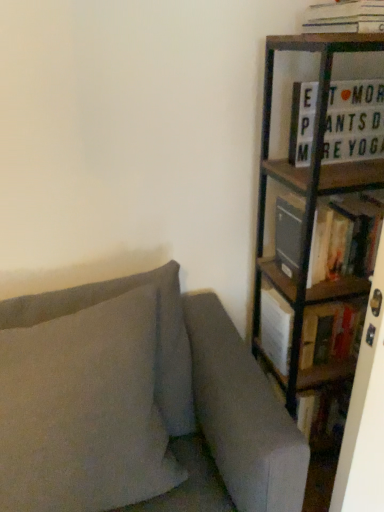
Measure the distance between point (297,111) and camera.

Point (297,111) and camera are 1.36 meters apart from each other.

What is the approximate height of hardcover book at right, the 3th book positioned from the top?

10.32 inches.

The height and width of the screenshot is (512, 384). Find the location of `hardcover book at right, which is the 1th book from bottom to top`. hardcover book at right, which is the 1th book from bottom to top is located at coordinates (329, 330).

Where is `white paper stack at upper right, which ranks as the third book in bottom-to-top order`? This screenshot has height=512, width=384. white paper stack at upper right, which ranks as the third book in bottom-to-top order is located at coordinates (345, 17).

The image size is (384, 512). Describe the element at coordinates (309, 209) in the screenshot. I see `wooden bookcase at right` at that location.

This screenshot has width=384, height=512. Find the location of `white plastic sign at upper right, which is counted as the second book, starting from the top`. white plastic sign at upper right, which is counted as the second book, starting from the top is located at coordinates (354, 121).

Based on the photo, is suede-like gray pillow at left to the left or to the right of white paper stack at upper right, which ranks as the third book in bottom-to-top order, in the image?

suede-like gray pillow at left is positioned on white paper stack at upper right, which ranks as the third book in bottom-to-top order,'s left side.

Considering the relative sizes of suede-like gray pillow at left and white paper stack at upper right, which ranks as the first book in top-to-bottom order, in the image provided, is suede-like gray pillow at left shorter than white paper stack at upper right, which ranks as the first book in top-to-bottom order,?

No, suede-like gray pillow at left is not shorter than white paper stack at upper right, which ranks as the first book in top-to-bottom order.

From a real-world perspective, who is located lower, suede-like gray pillow at left or white paper stack at upper right, which ranks as the first book in top-to-bottom order?

suede-like gray pillow at left.

Considering the sizes of objects white paper stack at upper right, which ranks as the first book in top-to-bottom order, and white plastic sign at upper right, which is counted as the second book, starting from the top, in the image provided, who is shorter, white paper stack at upper right, which ranks as the first book in top-to-bottom order, or white plastic sign at upper right, which is counted as the second book, starting from the top,?

Standing shorter between the two is white paper stack at upper right, which ranks as the first book in top-to-bottom order.

In the scene shown: Is white paper stack at upper right, which ranks as the first book in top-to-bottom order, situated inside white plastic sign at upper right, which is counted as the second book, starting from the top, or outside?

white paper stack at upper right, which ranks as the first book in top-to-bottom order, is spatially situated outside white plastic sign at upper right, which is counted as the second book, starting from the top.

From the image's perspective, is white paper stack at upper right, which ranks as the first book in top-to-bottom order, above white plastic sign at upper right, which ranks as the 2th book in bottom-to-top order?

Indeed, from the image's perspective, white paper stack at upper right, which ranks as the first book in top-to-bottom order, is shown above white plastic sign at upper right, which ranks as the 2th book in bottom-to-top order.

Which of these two, white paper stack at upper right, which ranks as the third book in bottom-to-top order, or white plastic sign at upper right, which is counted as the second book, starting from the top, is thinner?

Thinner between the two is white plastic sign at upper right, which is counted as the second book, starting from the top.

Is wooden bookshelf at right next to white plastic sign at upper right, which ranks as the 2th book in bottom-to-top order?

wooden bookshelf at right and white plastic sign at upper right, which ranks as the 2th book in bottom-to-top order, are clearly separated.

Is wooden bookshelf at right positioned with its back to white plastic sign at upper right, which is counted as the second book, starting from the top?

wooden bookshelf at right is not turned away from white plastic sign at upper right, which is counted as the second book, starting from the top.

Is point (312, 289) closer or farther from the camera than point (357, 135)?

Point (312, 289) is farther from the camera than point (357, 135).

Considering the relative positions of wooden bookshelf at right and white plastic sign at upper right, which is counted as the second book, starting from the top, in the image provided, is wooden bookshelf at right in front of white plastic sign at upper right, which is counted as the second book, starting from the top,?

No, wooden bookshelf at right is behind white plastic sign at upper right, which is counted as the second book, starting from the top.

Which of these two, wooden bookcase at right or white plastic sign at upper right, which ranks as the 2th book in bottom-to-top order, stands shorter?

white plastic sign at upper right, which ranks as the 2th book in bottom-to-top order, is shorter.

Between wooden bookcase at right and white plastic sign at upper right, which is counted as the second book, starting from the top, which one has smaller size?

With smaller size is white plastic sign at upper right, which is counted as the second book, starting from the top.

Which point is more forward, (x=277, y=163) or (x=332, y=115)?

The point (x=332, y=115) is in front.

From a real-world perspective, which is physically below, wooden bookcase at right or white plastic sign at upper right, which is counted as the second book, starting from the top?

In real-world perspective, wooden bookcase at right is lower.

Is point (61, 321) positioned behind point (291, 168)?

That is False.

Considering the relative positions of suede-like gray pillow at left and wooden bookcase at right in the image provided, is suede-like gray pillow at left to the left of wooden bookcase at right from the viewer's perspective?

Indeed, suede-like gray pillow at left is positioned on the left side of wooden bookcase at right.

From the image's perspective, is suede-like gray pillow at left under wooden bookcase at right?

Yes, from the image's perspective, suede-like gray pillow at left is beneath wooden bookcase at right.

In terms of width, does suede-like gray pillow at left look wider or thinner when compared to wooden bookcase at right?

suede-like gray pillow at left is thinner than wooden bookcase at right.

Does wooden bookshelf at right have a greater width compared to hardcover book at right, the 3th book positioned from the top?

Yes, wooden bookshelf at right is wider than hardcover book at right, the 3th book positioned from the top.

Is point (349, 289) positioned in front of point (266, 285)?

Yes.

Can hardcover book at right, which is the 1th book from bottom to top, be found inside wooden bookshelf at right?

No, hardcover book at right, which is the 1th book from bottom to top, is located outside of wooden bookshelf at right.

This screenshot has height=512, width=384. What are the coordinates of `pillow beneath the white plastic sign at upper right, which is counted as the second book, starting from the top (from a real-world perspective)` in the screenshot? It's located at (83, 411).

Is the position of suede-like gray pillow at left more distant than that of white plastic sign at upper right, which is counted as the second book, starting from the top?

No, suede-like gray pillow at left is in front of white plastic sign at upper right, which is counted as the second book, starting from the top.

Considering the relative positions of suede-like gray pillow at left and white plastic sign at upper right, which ranks as the 2th book in bottom-to-top order, in the image provided, is suede-like gray pillow at left to the right of white plastic sign at upper right, which ranks as the 2th book in bottom-to-top order, from the viewer's perspective?

Incorrect, suede-like gray pillow at left is not on the right side of white plastic sign at upper right, which ranks as the 2th book in bottom-to-top order.

How many degrees apart are the facing directions of suede-like gray pillow at left and white plastic sign at upper right, which is counted as the second book, starting from the top?

The angle between the facing direction of suede-like gray pillow at left and the facing direction of white plastic sign at upper right, which is counted as the second book, starting from the top, is 2.9 degrees.

Where is `pillow that appears below the white paper stack at upper right, which ranks as the first book in top-to-bottom order (from the image's perspective)`? This screenshot has width=384, height=512. pillow that appears below the white paper stack at upper right, which ranks as the first book in top-to-bottom order (from the image's perspective) is located at coordinates (83, 411).

From the white paper stack at upper right, which ranks as the third book in bottom-to-top order, count the 1st book to the left and point to it. Please provide its 2D coordinates.

[(354, 121)]

From the image, which object appears to be farther from wooden bookshelf at right, wooden bookcase at right or white paper stack at upper right, which ranks as the third book in bottom-to-top order?

The object further to wooden bookshelf at right is white paper stack at upper right, which ranks as the third book in bottom-to-top order.

Which object lies nearer to the anchor point wooden bookshelf at right, suede-like gray pillow at left or hardcover book at right, which is the 1th book from bottom to top?

Based on the image, hardcover book at right, which is the 1th book from bottom to top, appears to be nearer to wooden bookshelf at right.

Which object lies nearer to the anchor point white paper stack at upper right, which ranks as the third book in bottom-to-top order, wooden bookcase at right or wooden bookshelf at right?

wooden bookcase at right is positioned closer to the anchor white paper stack at upper right, which ranks as the third book in bottom-to-top order.

Looking at the image, which one is located further to wooden bookcase at right, suede-like gray pillow at left or hardcover book at right, the 3th book positioned from the top?

suede-like gray pillow at left.

Based on their spatial positions, is wooden bookcase at right or suede-like gray pillow at left closer to wooden bookshelf at right?

wooden bookcase at right is positioned closer to the anchor wooden bookshelf at right.

Which object lies further to the anchor point suede-like gray pillow at left, hardcover book at right, which is the 1th book from bottom to top, or white paper stack at upper right, which ranks as the first book in top-to-bottom order?

white paper stack at upper right, which ranks as the first book in top-to-bottom order.

Looking at the image, which one is located further to suede-like gray pillow at left, white paper stack at upper right, which ranks as the first book in top-to-bottom order, or wooden bookcase at right?

Among the two, white paper stack at upper right, which ranks as the first book in top-to-bottom order, is located further to suede-like gray pillow at left.

Based on their spatial positions, is wooden bookshelf at right or suede-like gray pillow at left closer to hardcover book at right, the 3th book positioned from the top?

Based on the image, wooden bookshelf at right appears to be nearer to hardcover book at right, the 3th book positioned from the top.

The width and height of the screenshot is (384, 512). What are the coordinates of `shelf between white paper stack at upper right, which ranks as the first book in top-to-bottom order, and wooden bookcase at right vertically` in the screenshot? It's located at (270, 262).

You are a GUI agent. You are given a task and a screenshot of the screen. Output one action in this format:
    pyautogui.click(x=<x>, y=<y>)
    Task: Click on the shelf between white plastic sign at upper right, which ranks as the 2th book in bottom-to-top order, and wooden bookcase at right in the up-down direction
    
    Given the screenshot: What is the action you would take?
    pyautogui.click(x=270, y=262)

You are a GUI agent. You are given a task and a screenshot of the screen. Output one action in this format:
    pyautogui.click(x=<x>, y=<y>)
    Task: Click on the shelf that lies between white paper stack at upper right, which ranks as the first book in top-to-bottom order, and suede-like gray pillow at left from top to bottom
    
    Given the screenshot: What is the action you would take?
    pyautogui.click(x=270, y=262)

Find the location of `shelf between suede-like gray pillow at left and wooden bookcase at right from left to right`. shelf between suede-like gray pillow at left and wooden bookcase at right from left to right is located at coordinates (270, 262).